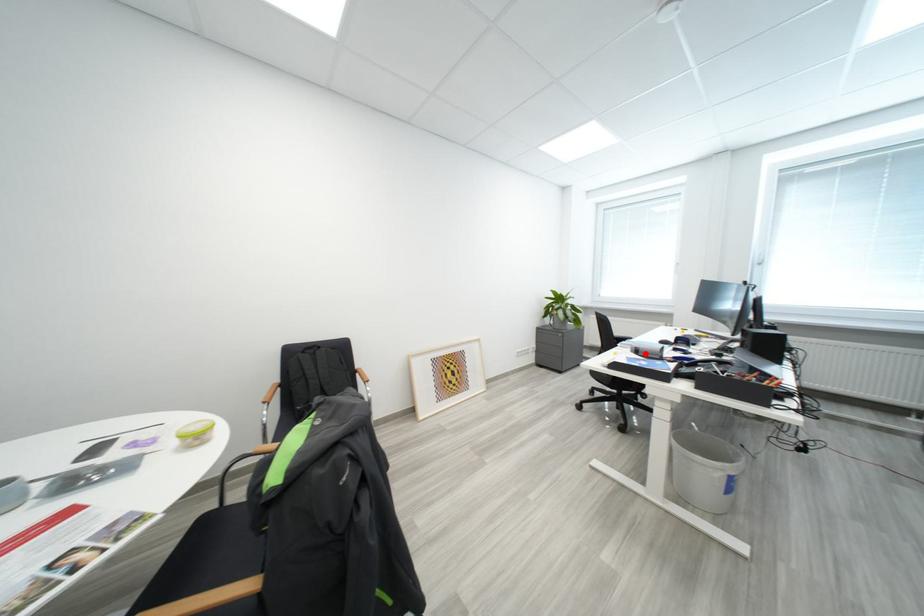
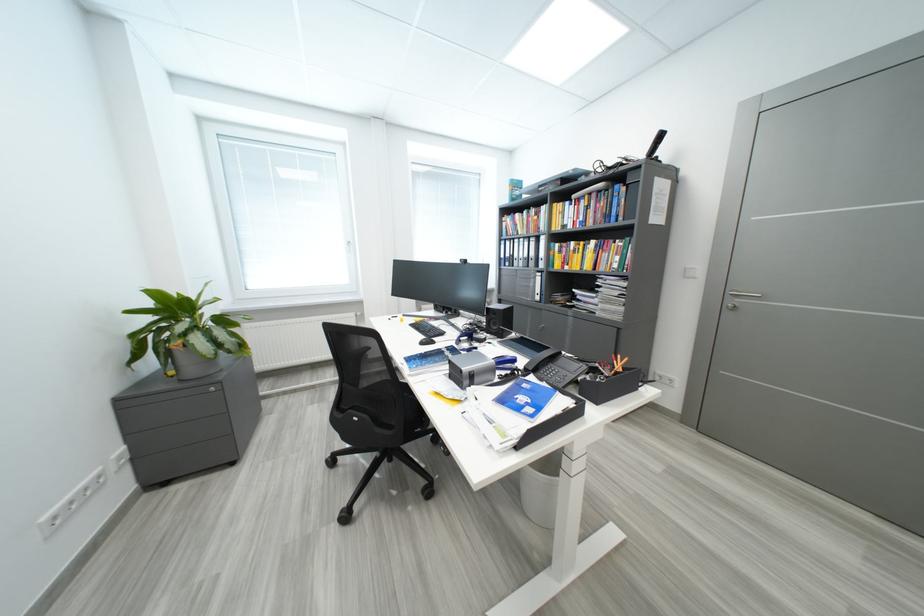
Locate, in the second image, the point that corresponds to the highlighted location in the first image.

(481, 381)